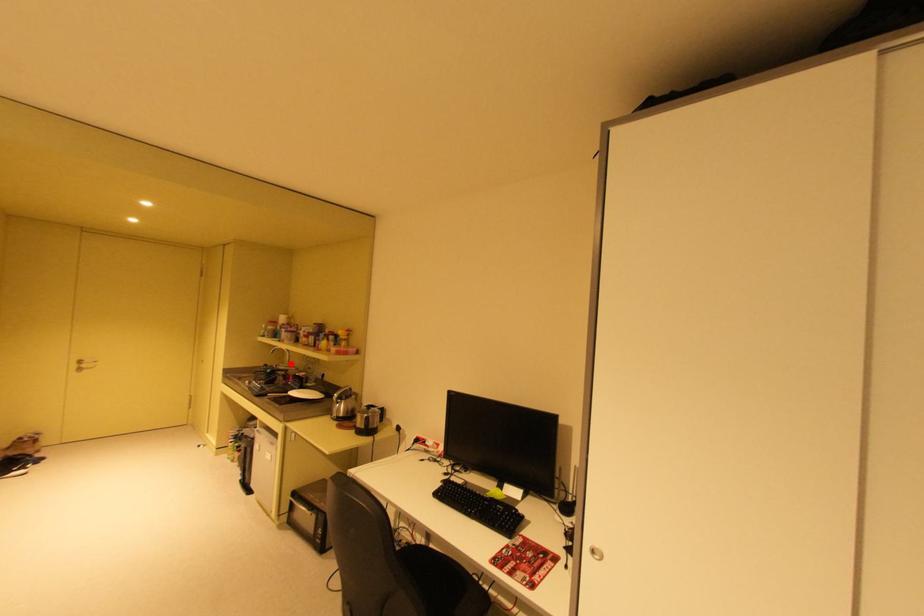
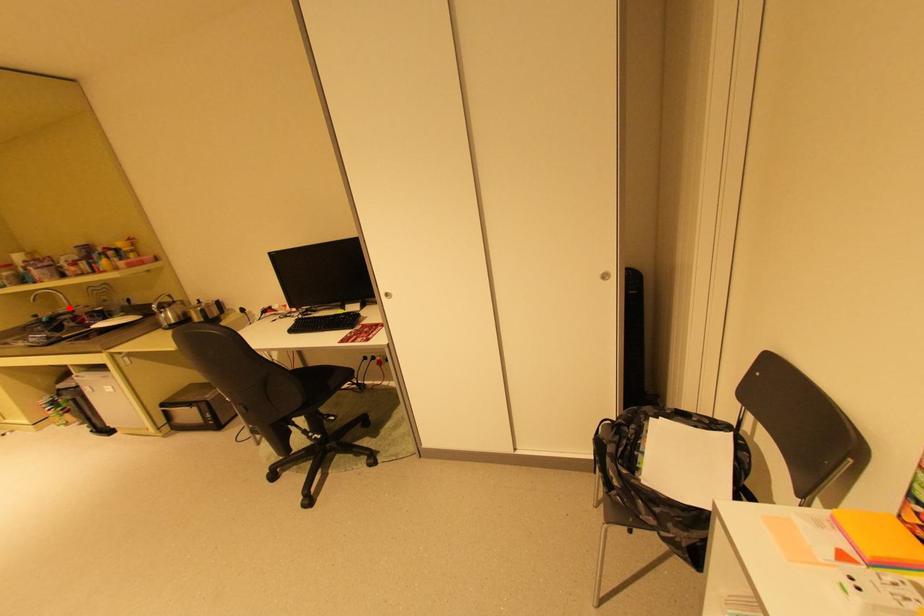
I am providing you with two images of the same scene from different viewpoints. A red point is marked on the first image and another point is marked on the second image. Are the points marked in image1 and image2 representing the same 3D position?

Yes